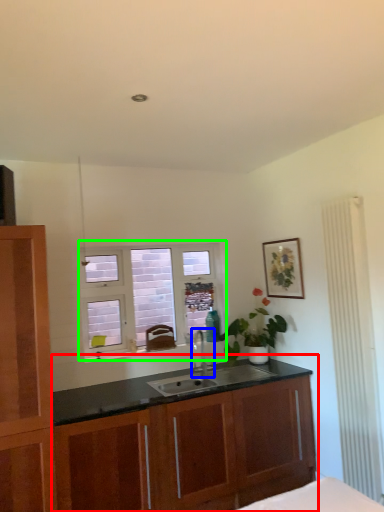
Question: Considering the real-world distances, which object is farthest from cabinetry (highlighted by a red box)? tap (highlighted by a blue box) or window (highlighted by a green box)?

Choices:
 (A) tap
 (B) window

Answer: (B)